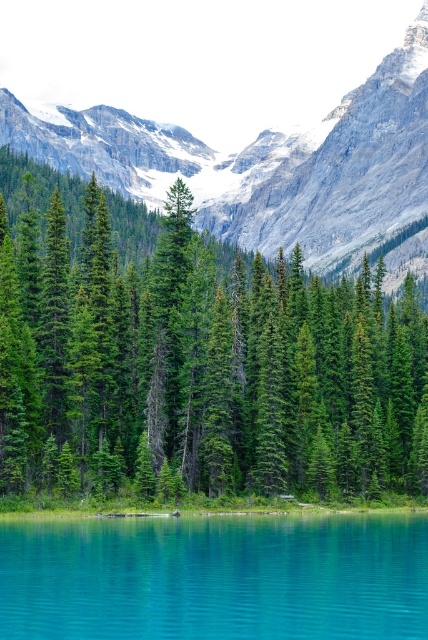
You are a hiker planning to traverse the distance between the green matte pine forest at center and the rocky gray mountain at upper center. Given that your average walking pace is 5 km per hour, how long would it take you to reach the mountain from the forest?

Answer: The distance between the green matte pine forest at center and the rocky gray mountain at upper center is 141.28 meters. At a walking pace of 5 km per hour, it would take approximately 16.95 seconds to cover this distance. Therefore, you would reach the mountain in roughly 17 seconds.

You are standing at the edge of the lake and want to reach the green matte pine forest at center. According to the coordinates provided, in which direction should you head from your current position?

The green matte pine forest at center is located at coordinates point (196, 362), which means you should head towards the center of the image from your current position at the lake edge to reach it.